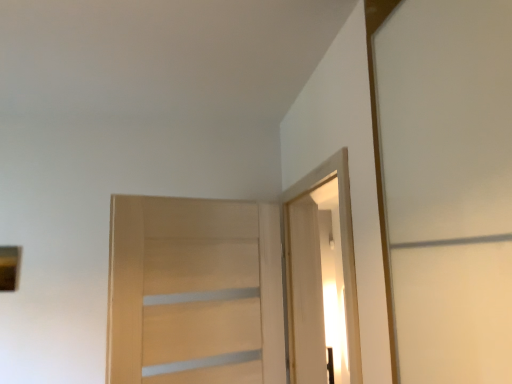
In order to face white wood door at upper right, which is the second door in left-to-right order, should I rotate leftwards or rightwards?

Rotate your view right by about 6.669°.

At what (x,y) coordinates should I click in order to perform the action: click on white wood door at upper right, which is the second door in left-to-right order. Please return your answer as a coordinate pair (x, y). Looking at the image, I should click on (305, 293).

Could you tell me if white wood door at upper right, which appears as the first door when viewed from the right, is turned towards light wood door at center, which is the 2th door from right to left?

No.

Considering the sizes of objects white wood door at upper right, which appears as the first door when viewed from the right, and light wood door at center, which is the 2th door from right to left, in the image provided, who is wider, white wood door at upper right, which appears as the first door when viewed from the right, or light wood door at center, which is the 2th door from right to left,?

white wood door at upper right, which appears as the first door when viewed from the right, is wider.

Which object is further away from the camera taking this photo, white wood door at upper right, which appears as the first door when viewed from the right, or light wood door at center, which is the 2th door from right to left?

white wood door at upper right, which appears as the first door when viewed from the right, is behind.

Can you tell me how much white wood door at upper right, which is the second door in left-to-right order, and light wood door at center, which is the 2th door from right to left, differ in facing direction?

There is a 67.7-degree angle between the facing directions of white wood door at upper right, which is the second door in left-to-right order, and light wood door at center, which is the 2th door from right to left.

Would you say white wood door at upper right, which appears as the first door when viewed from the right, is inside or outside white glossy elevator at upper right?

white wood door at upper right, which appears as the first door when viewed from the right, exists outside the volume of white glossy elevator at upper right.

From the picture: Considering the sizes of white wood door at upper right, which appears as the first door when viewed from the right, and white glossy elevator at upper right in the image, is white wood door at upper right, which appears as the first door when viewed from the right, bigger or smaller than white glossy elevator at upper right?

white wood door at upper right, which appears as the first door when viewed from the right, is smaller than white glossy elevator at upper right.

Is white wood door at upper right, which is the second door in left-to-right order, beside white glossy elevator at upper right?

No, white wood door at upper right, which is the second door in left-to-right order, is not making contact with white glossy elevator at upper right.

Would you say white glossy elevator at upper right is to the left or to the right of white wood door at upper right, which is the second door in left-to-right order, in the picture?

Based on their positions, white glossy elevator at upper right is located to the right of white wood door at upper right, which is the second door in left-to-right order.

Is white wood door at upper right, which is the second door in left-to-right order, at the back of white glossy elevator at upper right?

No, white wood door at upper right, which is the second door in left-to-right order, is not at the back of white glossy elevator at upper right.

Is white glossy elevator at upper right in front of or behind white wood door at upper right, which is the second door in left-to-right order, in the image?

Clearly, white glossy elevator at upper right is in front of white wood door at upper right, which is the second door in left-to-right order.

In the image, there is a white wood door at upper right, which is the second door in left-to-right order. Identify the location of elevator above it (from the image's perspective). Image resolution: width=512 pixels, height=384 pixels. (321, 273).

From the image's perspective, is white glossy elevator at upper right beneath light wood door at center, which is counted as the first door, starting from the left?

No, from the image's perspective, white glossy elevator at upper right is not below light wood door at center, which is counted as the first door, starting from the left.

Could you tell me if white glossy elevator at upper right is facing light wood door at center, which is counted as the first door, starting from the left?

Yes, white glossy elevator at upper right is oriented towards light wood door at center, which is counted as the first door, starting from the left.

Is white glossy elevator at upper right not close to light wood door at center, which is the 2th door from right to left?

white glossy elevator at upper right is near light wood door at center, which is the 2th door from right to left, not far away.

Does light wood door at center, which is the 2th door from right to left, come in front of white glossy elevator at upper right?

No, it is not.

Which is correct: light wood door at center, which is counted as the first door, starting from the left, is inside white glossy elevator at upper right, or outside of it?

light wood door at center, which is counted as the first door, starting from the left, cannot be found inside white glossy elevator at upper right.

Is light wood door at center, which is the 2th door from right to left, next to white glossy elevator at upper right?

light wood door at center, which is the 2th door from right to left, and white glossy elevator at upper right are not in contact.

Can you tell me how much light wood door at center, which is the 2th door from right to left, and white glossy elevator at upper right differ in facing direction?

They differ by 113 degrees in their facing directions.

Looking at their sizes, would you say light wood door at center, which is the 2th door from right to left, is wider or thinner than white wood door at upper right, which is the second door in left-to-right order?

Clearly, light wood door at center, which is the 2th door from right to left, has less width compared to white wood door at upper right, which is the second door in left-to-right order.

Is light wood door at center, which is the 2th door from right to left, shorter than white wood door at upper right, which appears as the first door when viewed from the right?

Yes.

Is light wood door at center, which is counted as the first door, starting from the left, next to white wood door at upper right, which is the second door in left-to-right order?

No.

Considering the relative sizes of light wood door at center, which is the 2th door from right to left, and white wood door at upper right, which appears as the first door when viewed from the right, in the image provided, is light wood door at center, which is the 2th door from right to left, bigger than white wood door at upper right, which appears as the first door when viewed from the right,?

Indeed, light wood door at center, which is the 2th door from right to left, has a larger size compared to white wood door at upper right, which appears as the first door when viewed from the right.

Locate an element on the screen. door behind the light wood door at center, which is the 2th door from right to left is located at coordinates pyautogui.click(x=305, y=293).

Where is `elevator that appears in front of the white wood door at upper right, which is the second door in left-to-right order`? The width and height of the screenshot is (512, 384). elevator that appears in front of the white wood door at upper right, which is the second door in left-to-right order is located at coordinates [x=321, y=273].

Looking at the image, which one is located closer to white glossy elevator at upper right, white wood door at upper right, which is the second door in left-to-right order, or light wood door at center, which is counted as the first door, starting from the left?

white wood door at upper right, which is the second door in left-to-right order, lies closer to white glossy elevator at upper right than the other object.

From the image, which object appears to be farther from white wood door at upper right, which appears as the first door when viewed from the right, white glossy elevator at upper right or light wood door at center, which is counted as the first door, starting from the left?

light wood door at center, which is counted as the first door, starting from the left, is further to white wood door at upper right, which appears as the first door when viewed from the right.

Looking at the image, which one is located closer to light wood door at center, which is the 2th door from right to left, white wood door at upper right, which is the second door in left-to-right order, or white glossy elevator at upper right?

Among the two, white wood door at upper right, which is the second door in left-to-right order, is located nearer to light wood door at center, which is the 2th door from right to left.

From the image, which object appears to be farther from white glossy elevator at upper right, light wood door at center, which is counted as the first door, starting from the left, or white wood door at upper right, which appears as the first door when viewed from the right?

light wood door at center, which is counted as the first door, starting from the left.

Estimate the real-world distances between objects in this image. Which object is further from white wood door at upper right, which is the second door in left-to-right order, light wood door at center, which is counted as the first door, starting from the left, or white glossy elevator at upper right?

Based on the image, light wood door at center, which is counted as the first door, starting from the left, appears to be further to white wood door at upper right, which is the second door in left-to-right order.

Estimate the real-world distances between objects in this image. Which object is further from light wood door at center, which is counted as the first door, starting from the left, white glossy elevator at upper right or white wood door at upper right, which appears as the first door when viewed from the right?

white glossy elevator at upper right is further to light wood door at center, which is counted as the first door, starting from the left.

Where is `door between white glossy elevator at upper right and white wood door at upper right, which is the second door in left-to-right order, in the front-back direction`? The image size is (512, 384). door between white glossy elevator at upper right and white wood door at upper right, which is the second door in left-to-right order, in the front-back direction is located at coordinates (194, 292).